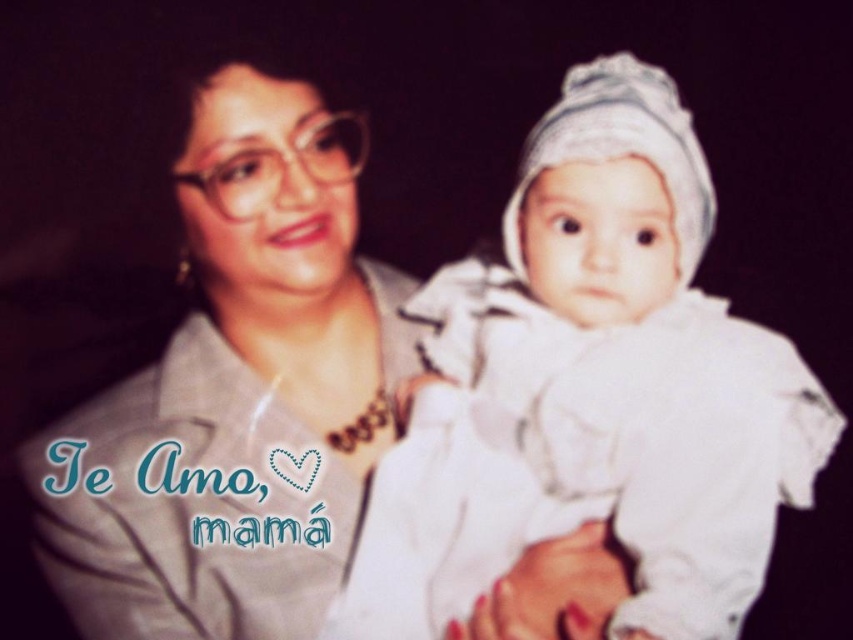
You are a photographer adjusting the lighting in a studio. You notice the white soft cloth at center and the matte gray shirt at center in the scene. Which object should you focus the light on if you want to highlight the taller one?

The matte gray shirt at center is taller than the white soft cloth at center, so you should focus the light on the matte gray shirt at center to highlight the taller object.

You are a photographer adjusting the lighting in the studio. You notice the white soft cloth at center is casting a shadow on the baby. To avoid this shadow, should you move the light source closer to or further away from the cloth?

The white soft cloth at center is located at point (596, 390). Moving the light source further away from the cloth would reduce the shadow it casts on the baby.

You are a photographer adjusting the lighting for a portrait. You notice the white soft cloth at center and the matte gray shirt at center in the scene. Which object should you adjust the light to highlight first if you want to ensure the one above is properly lit?

The matte gray shirt at center should be adjusted first since the white soft cloth at center is located below it, ensuring the upper object receives adequate lighting.